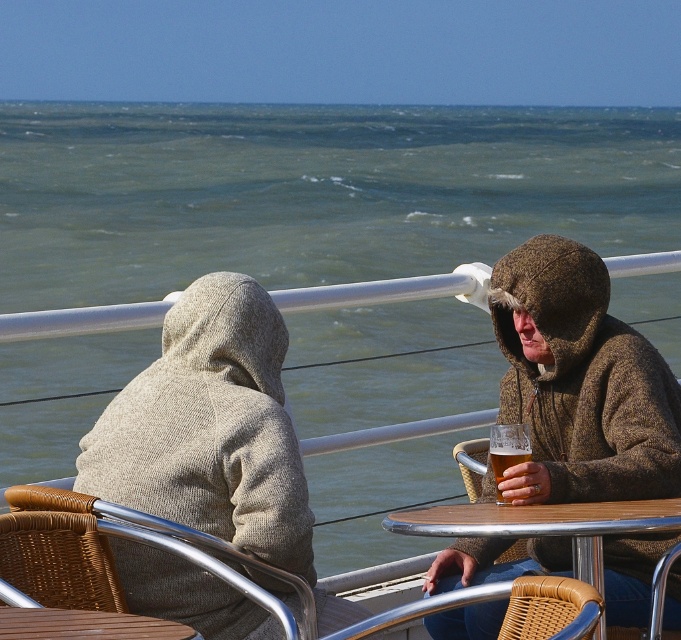
The width and height of the screenshot is (681, 640). What do you see at coordinates (545, 525) in the screenshot? I see `wooden table at center` at bounding box center [545, 525].

Can you confirm if wooden table at center is positioned to the right of brown wood table at lower left?

Correct, you'll find wooden table at center to the right of brown wood table at lower left.

Between point (443, 522) and point (10, 609), which one is positioned in front?

Point (10, 609) is in front.

At what (x,y) coordinates should I click in order to perform the action: click on wooden table at center. Please return your answer as a coordinate pair (x, y). This screenshot has width=681, height=640. Looking at the image, I should click on (545, 525).

Is greenish-blue water at center closer to the viewer compared to brown woolen jacket at center?

No.

Is greenish-blue water at center thinner than brown woolen jacket at center?

No, greenish-blue water at center is not thinner than brown woolen jacket at center.

Image resolution: width=681 pixels, height=640 pixels. In order to click on greenish-blue water at center in this screenshot , I will do `click(313, 192)`.

Is the position of greenish-blue water at center less distant than that of translucent glass beer at right?

No, it is not.

You are a GUI agent. You are given a task and a screenshot of the screen. Output one action in this format:
    pyautogui.click(x=<x>, y=<y>)
    Task: Click on the greenish-blue water at center
    Image resolution: width=681 pixels, height=640 pixels.
    Given the screenshot: What is the action you would take?
    pyautogui.click(x=313, y=192)

Which is behind, point (221, 252) or point (505, 464)?

The point (221, 252) is behind.

Where is `greenish-blue water at center`? greenish-blue water at center is located at coordinates (313, 192).